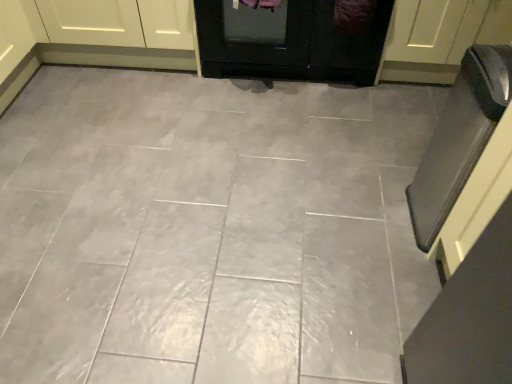
Question: Is the surface of matte white cabinet at upper left in direct contact with white glossy door at upper right, which appears as the first door when viewed from the right?

Choices:
 (A) yes
 (B) no

Answer: (B)

Question: Are matte white cabinet at upper left and white glossy door at upper right, the second door when ordered from left to right, far apart?

Choices:
 (A) yes
 (B) no

Answer: (A)

Question: Can you confirm if matte white cabinet at upper left is shorter than white glossy door at upper right, which appears as the first door when viewed from the right?

Choices:
 (A) no
 (B) yes

Answer: (B)

Question: Is matte white cabinet at upper left wider than white glossy door at upper right, the second door when ordered from left to right?

Choices:
 (A) yes
 (B) no

Answer: (A)

Question: Is matte white cabinet at upper left facing towards white glossy door at upper right, which appears as the first door when viewed from the right?

Choices:
 (A) no
 (B) yes

Answer: (A)

Question: Considering the relative sizes of matte white cabinet at upper left and white glossy door at upper right, the second door when ordered from left to right, in the image provided, is matte white cabinet at upper left thinner than white glossy door at upper right, the second door when ordered from left to right,?

Choices:
 (A) no
 (B) yes

Answer: (A)

Question: From a real-world perspective, is white glossy door at upper right, which appears as the first door when viewed from the right, on black glass oven at right?

Choices:
 (A) no
 (B) yes

Answer: (A)

Question: Considering the relative sizes of white glossy door at upper right, which appears as the first door when viewed from the right, and black glass oven at right in the image provided, is white glossy door at upper right, which appears as the first door when viewed from the right, thinner than black glass oven at right?

Choices:
 (A) no
 (B) yes

Answer: (A)

Question: From a real-world perspective, is white glossy door at upper right, the second door when ordered from left to right, physically below black glass oven at right?

Choices:
 (A) yes
 (B) no

Answer: (A)

Question: Can you confirm if white glossy door at upper right, the second door when ordered from left to right, is positioned to the right of black glass oven at right?

Choices:
 (A) yes
 (B) no

Answer: (A)

Question: Can you confirm if white glossy door at upper right, which appears as the first door when viewed from the right, is bigger than black glass oven at right?

Choices:
 (A) no
 (B) yes

Answer: (B)

Question: Is white glossy door at upper right, which appears as the first door when viewed from the right, at the left side of black glass oven at right?

Choices:
 (A) no
 (B) yes

Answer: (A)

Question: From a real-world perspective, does matte white cabinet at upper left stand above gray glossy tile at center?

Choices:
 (A) no
 (B) yes

Answer: (B)